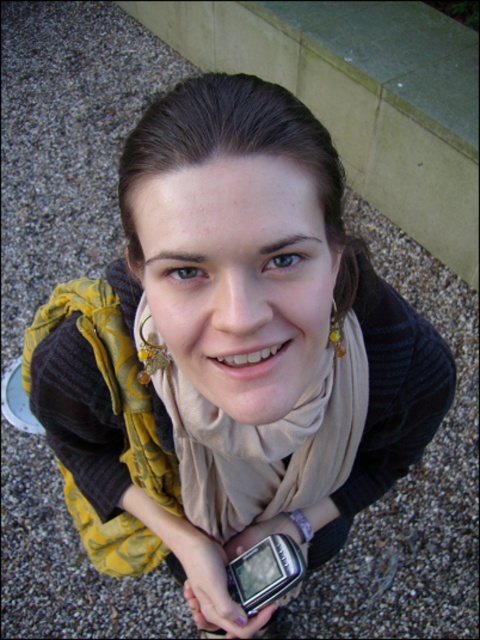
Which is in front, point (354, 451) or point (195, 556)?

Point (354, 451)

Is point (254, 428) farther from viewer compared to point (213, 618)?

No, (254, 428) is in front of (213, 618).

Image resolution: width=480 pixels, height=640 pixels. Find the location of `beige soft scarf at center`. beige soft scarf at center is located at coordinates (261, 436).